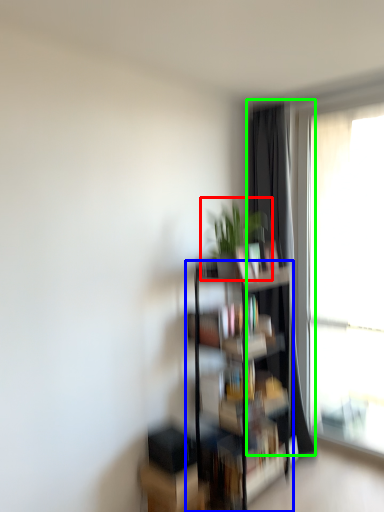
Question: Based on their relative distances, which object is nearer to houseplant (highlighted by a red box)? Choose from shelf (highlighted by a blue box) and curtain (highlighted by a green box).

Choices:
 (A) shelf
 (B) curtain

Answer: (B)